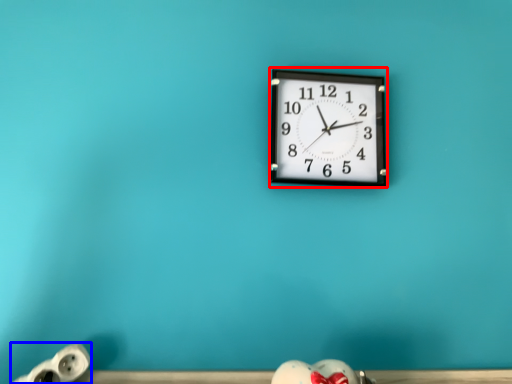
Question: Which of the following is the farthest to the observer, wall clock (highlighted by a red box) or toy (highlighted by a blue box)?

Choices:
 (A) wall clock
 (B) toy

Answer: (A)